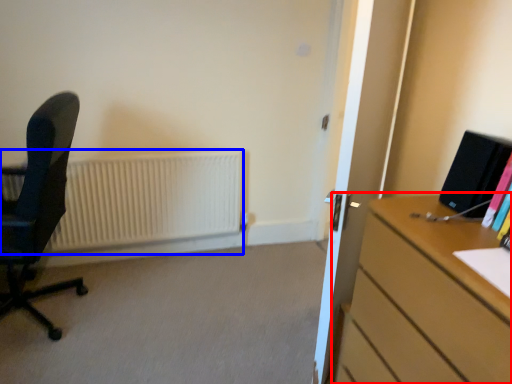
Question: Which point is further to the camera, desk (highlighted by a red box) or radiator (highlighted by a blue box)?

Choices:
 (A) desk
 (B) radiator

Answer: (B)